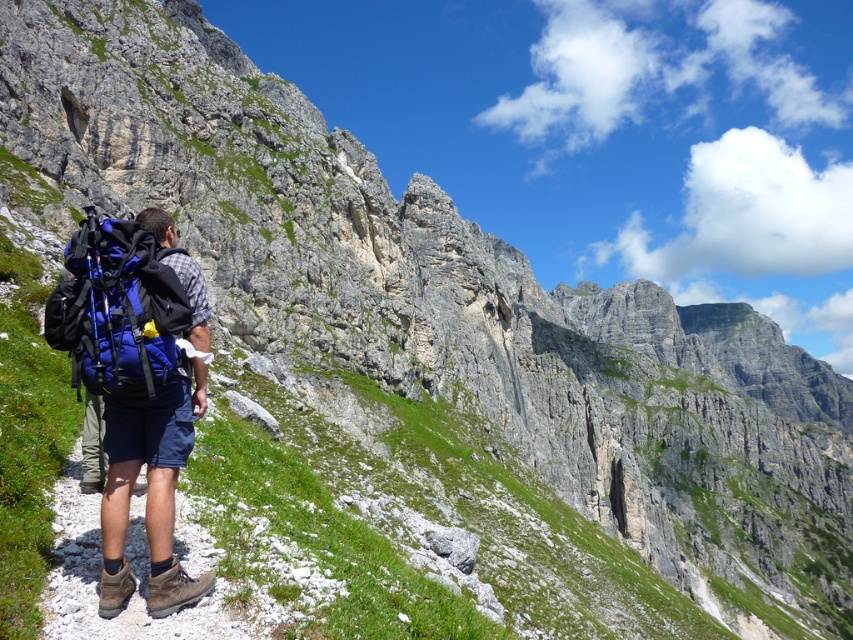
Does blue fabric backpack at left appear on the left side of blue fabric backpack at center?

No, blue fabric backpack at left is not to the left of blue fabric backpack at center.

Can you confirm if blue fabric backpack at left is shorter than blue fabric backpack at center?

In fact, blue fabric backpack at left may be taller than blue fabric backpack at center.

Is point (126, 288) closer to viewer compared to point (93, 252)?

Yes, it is in front of point (93, 252).

This screenshot has height=640, width=853. Find the location of `blue fabric backpack at left`. blue fabric backpack at left is located at coordinates (142, 387).